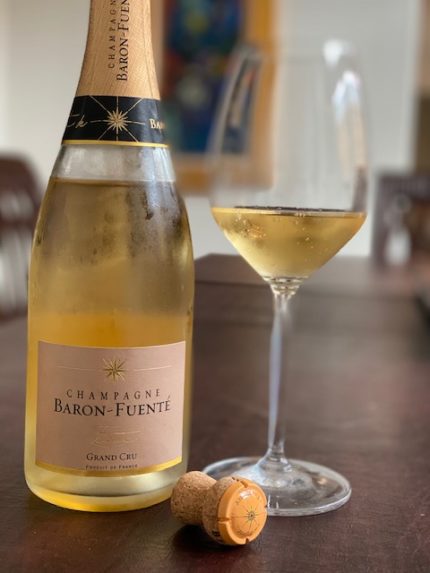
The image size is (430, 573). Find the location of `wine in glass`. wine in glass is located at coordinates (297, 252).